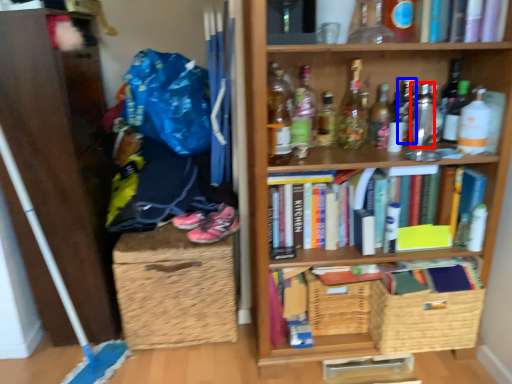
Question: Among these objects, which one is farthest to the camera, bottle (highlighted by a red box) or bottle (highlighted by a blue box)?

Choices:
 (A) bottle
 (B) bottle

Answer: (B)